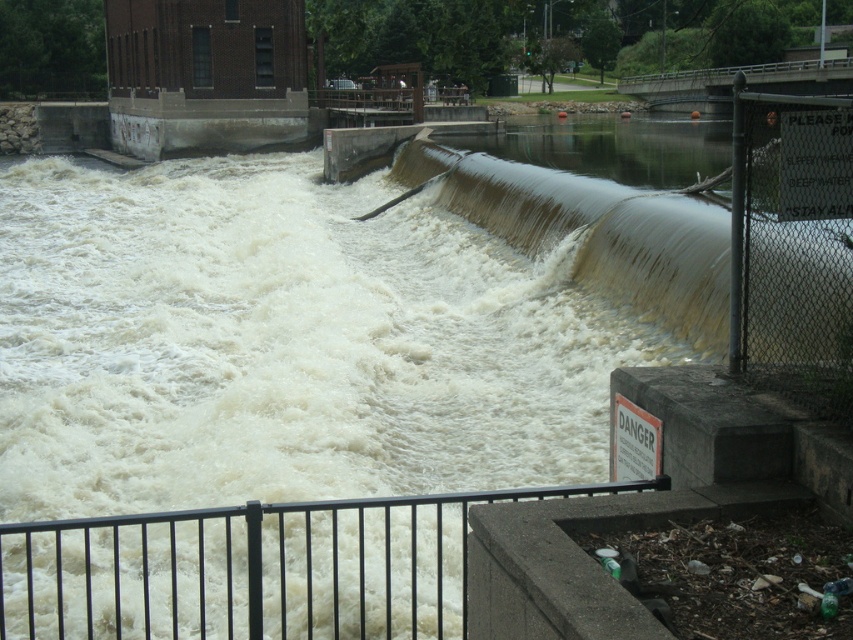
Can you confirm if black metal fence at lower left is smaller than black chain-link fence at right?

Correct, black metal fence at lower left occupies less space than black chain-link fence at right.

Image resolution: width=853 pixels, height=640 pixels. Identify the location of black metal fence at lower left. (254, 568).